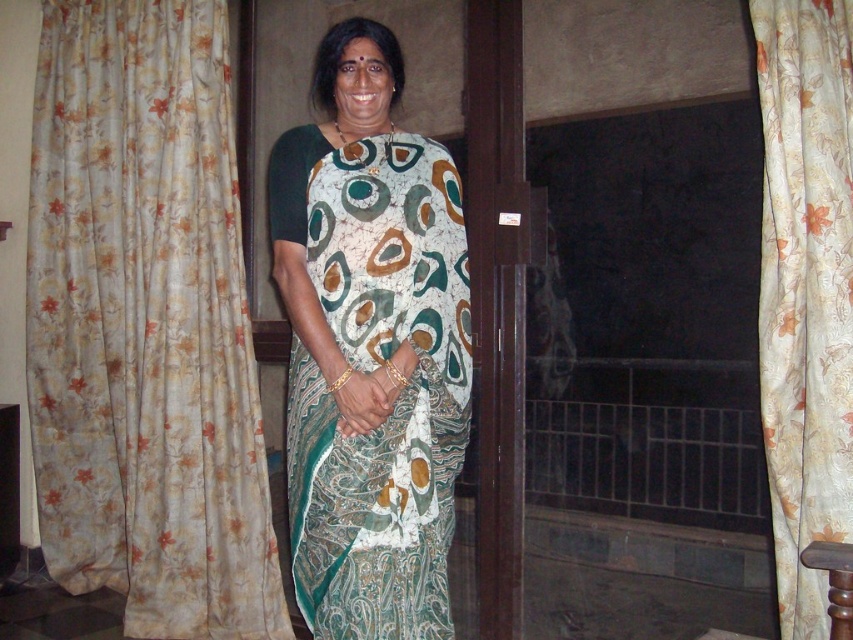
You are a guest entering the room and see the floral fabric curtain at left and the floral silk curtain at right. Which curtain is closer to the doorway you just came through?

The floral fabric curtain at left is closer to the doorway you just came through because it is positioned to the left of the floral silk curtain at right, which is further away from the entrance.

You are a fashion designer observing the image. You need to determine which object is taller between the floral fabric curtain at left and the printed silk saree at center. Based on the scene, which one is taller?

The floral fabric curtain at left is taller than the printed silk saree at center.

You are a photographer setting up a shoot in this room. You need to ensure that the printed silk saree at center is visible in the frame without being blocked by the floral silk curtain at right. Based on their positions, is this arrangement possible?

The printed silk saree at center is positioned under the floral silk curtain at right, so it is possible to angle the camera or adjust the setup so that the saree remains visible without obstruction from the curtain.